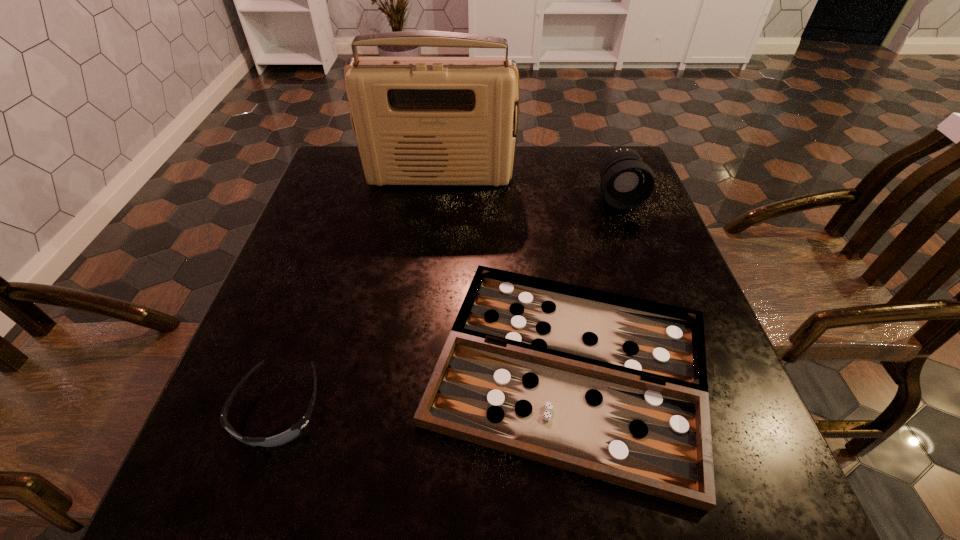
You are a GUI agent. You are given a task and a screenshot of the screen. Output one action in this format:
    pyautogui.click(x=<x>, y=<y>)
    Task: Click on the sunglasses present at the near edge
    The image size is (960, 540).
    Given the screenshot: What is the action you would take?
    pyautogui.click(x=296, y=430)

You are a GUI agent. You are given a task and a screenshot of the screen. Output one action in this format:
    pyautogui.click(x=<x>, y=<y>)
    Task: Click on the gameboard that is at the near edge
    Image resolution: width=960 pixels, height=540 pixels.
    Given the screenshot: What is the action you would take?
    pyautogui.click(x=613, y=387)

In order to click on radio receiver that is positioned at the left edge in this screenshot , I will do `click(417, 120)`.

Where is `sunglasses situated at the left edge`? sunglasses situated at the left edge is located at coordinates (296, 430).

At what (x,y) coordinates should I click in order to perform the action: click on telephoto lens present at the right edge. Please return your answer as a coordinate pair (x, y). This screenshot has height=540, width=960. Looking at the image, I should click on [x=626, y=181].

The height and width of the screenshot is (540, 960). Find the location of `gameboard located in the right edge section of the desktop`. gameboard located in the right edge section of the desktop is located at coordinates (613, 387).

The height and width of the screenshot is (540, 960). In order to click on object that is at the far left corner in this screenshot , I will do coord(417,120).

You are a GUI agent. You are given a task and a screenshot of the screen. Output one action in this format:
    pyautogui.click(x=<x>, y=<y>)
    Task: Click on the object that is at the near left corner
    Image resolution: width=960 pixels, height=540 pixels.
    Given the screenshot: What is the action you would take?
    pyautogui.click(x=296, y=430)

This screenshot has height=540, width=960. Identify the location of object positioned at the far right corner. (626, 181).

This screenshot has width=960, height=540. I want to click on object present at the near right corner, so click(613, 387).